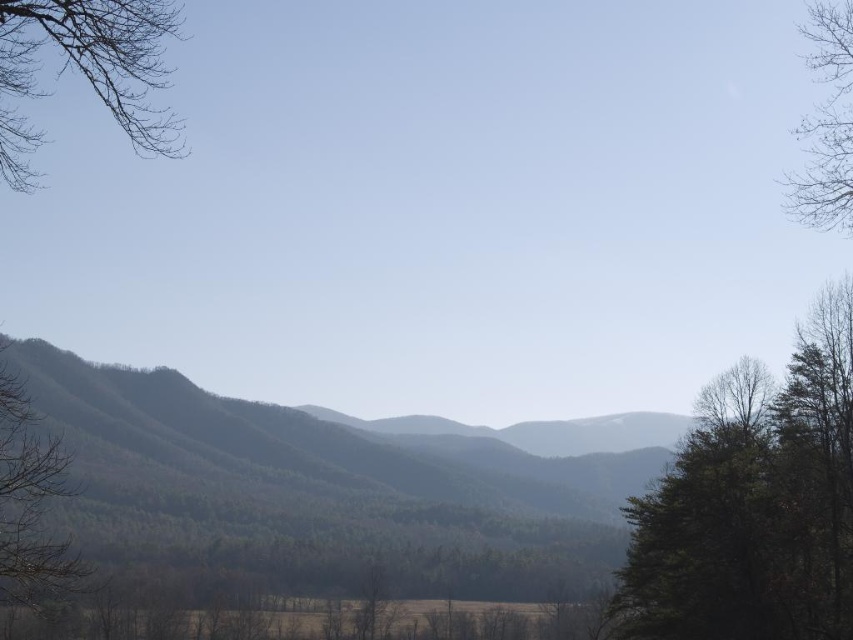
Is green forested mountain at center bigger than bare branches at upper left?

No, green forested mountain at center is not bigger than bare branches at upper left.

At what (x,y) coordinates should I click in order to perform the action: click on green forested mountain at center. Please return your answer as a coordinate pair (x, y). Looking at the image, I should click on (328, 486).

This screenshot has width=853, height=640. Describe the element at coordinates (328, 486) in the screenshot. I see `green forested mountain at center` at that location.

The height and width of the screenshot is (640, 853). Identify the location of green forested mountain at center. click(x=328, y=486).

Does green leafy tree at right have a larger size compared to green matte tree at left?

Yes, green leafy tree at right is bigger than green matte tree at left.

Between green leafy tree at right and green matte tree at left, which one is positioned lower?

green leafy tree at right is below.

Between point (674, 636) and point (15, 545), which one is positioned behind?

The point (674, 636) is behind.

Locate an element on the screen. green leafy tree at right is located at coordinates (753, 504).

Can you confirm if green leafy tree at right is positioned below bare branches at upper right?

Correct, green leafy tree at right is located below bare branches at upper right.

Consider the image. Between green leafy tree at right and bare branches at upper right, which one appears on the right side from the viewer's perspective?

Positioned to the right is bare branches at upper right.

In the scene shown: Measure the distance between green leafy tree at right and camera.

green leafy tree at right and camera are 37.24 meters apart from each other.

Identify the location of green leafy tree at right. coord(753,504).